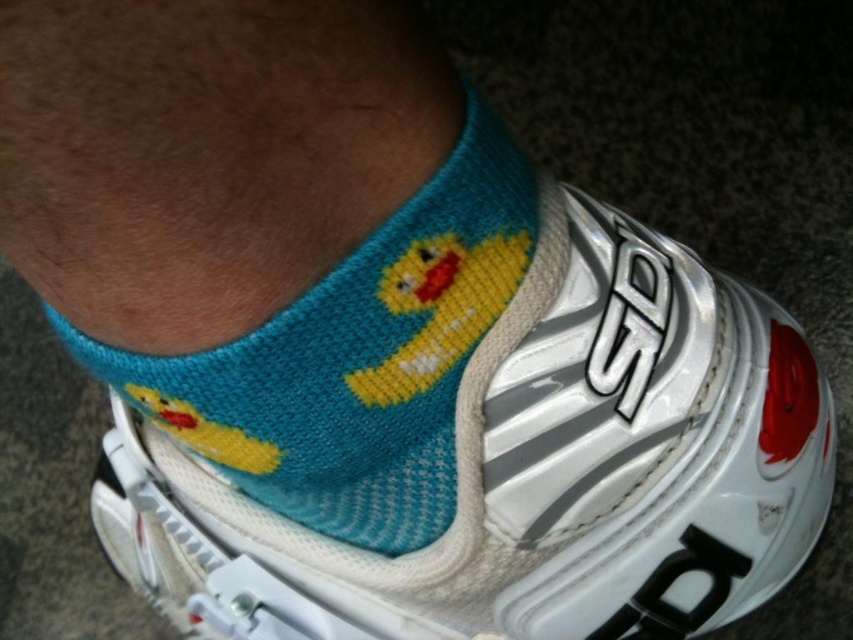
You are a shoe designer trying to create a new pair of cycling shoes. You want to ensure the socks you design will fit comfortably inside the shoe. Based on the image, which object is wider, the white mesh shoe at center or the teal knitted socks at center?

The white mesh shoe at center might be wider than teal knitted socks at center, so the teal knitted socks at center should fit comfortably inside the white mesh shoe at center.

You are a photographer trying to capture a closeup shot of the white mesh shoe at center. Your camera has a minimum focusing distance of 18 inches. Can you take the photo without moving the shoe?

The white mesh shoe at center is 20.05 inches away from the viewer, which is beyond the camera minimum focusing distance of 18 inches. Therefore, you can take the photo without moving the shoe.